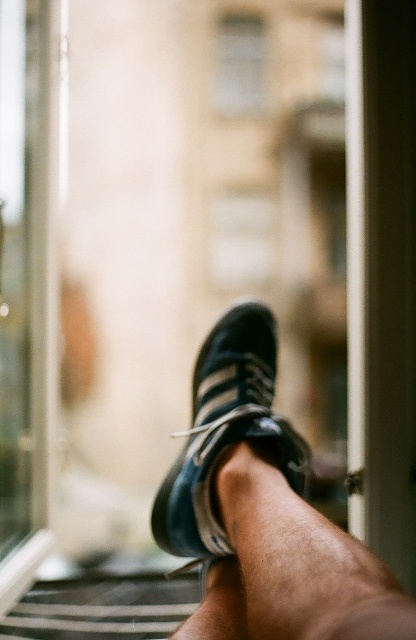
Question: Does transparent glass door at left have a greater width compared to black suede shoe at center?

Choices:
 (A) no
 (B) yes

Answer: (A)

Question: Is matte black sneaker at center above black suede shoe at center?

Choices:
 (A) no
 (B) yes

Answer: (A)

Question: Which point appears closest to the camera in this image?

Choices:
 (A) (27, 266)
 (B) (232, 472)
 (C) (165, 493)

Answer: (B)

Question: Which point appears closest to the camera in this image?

Choices:
 (A) (12, 400)
 (B) (247, 328)

Answer: (B)

Question: Is matte black sneaker at center to the left of black suede shoe at center from the viewer's perspective?

Choices:
 (A) no
 (B) yes

Answer: (A)

Question: Which point is closer to the camera?

Choices:
 (A) transparent glass door at left
 (B) black suede shoe at center
 (C) matte black sneaker at center

Answer: (C)